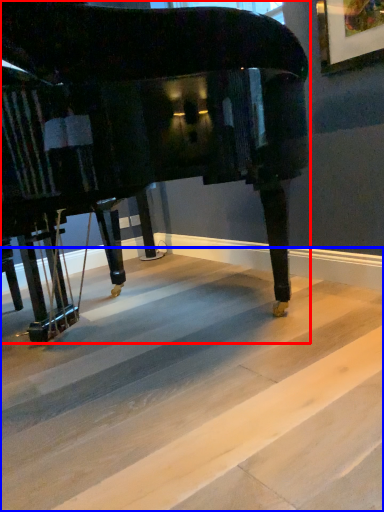
Question: Which point is further to the camera, piano (highlighted by a red box) or concrete (highlighted by a blue box)?

Choices:
 (A) piano
 (B) concrete

Answer: (A)